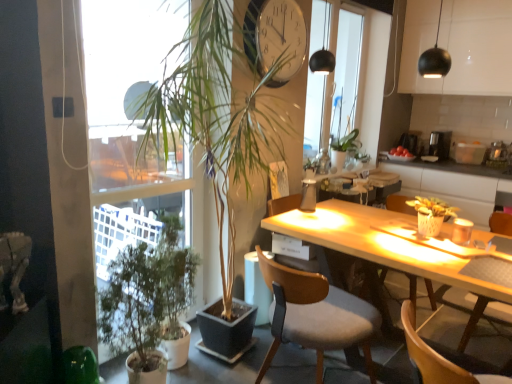
Question: Visually, is green matte plant at left, which is counted as the 1th houseplant, starting from the left, positioned to the left or to the right of translucent glass bottle at center, positioned as the first bottle in back-to-front order?

Choices:
 (A) left
 (B) right

Answer: (A)

Question: Is green matte plant at left, the 3th houseplant viewed from the right, situated inside translucent glass bottle at center, marked as the 1th bottle in a top-to-bottom arrangement, or outside?

Choices:
 (A) inside
 (B) outside

Answer: (B)

Question: Considering the real-world distances, which object is closest to the black plastic coffee maker at upper right?

Choices:
 (A) black matte lamp at upper center, the second lamp when ordered from right to left
 (B) transparent glass window at center
 (C) matte black sphere at upper right, positioned as the first lamp in front-to-back order
 (D) translucent glass bottle at table center, positioned as the second bottle in back-to-front order
 (E) green matte plant at right, the 1th houseplant viewed from the right

Answer: (B)

Question: Estimate the real-world distances between objects in this image. Which object is farther from the transparent glass window at center?

Choices:
 (A) translucent glass bottle at table center, the 1th bottle ordered from the bottom
 (B) wooden chair at lower right, acting as the first chair starting from the front
 (C) translucent glass bottle at center, marked as the 1th bottle in a top-to-bottom arrangement
 (D) wooden chair at center, which appears as the 3th chair when viewed from the front
 (E) metallic clock at upper center

Answer: (B)